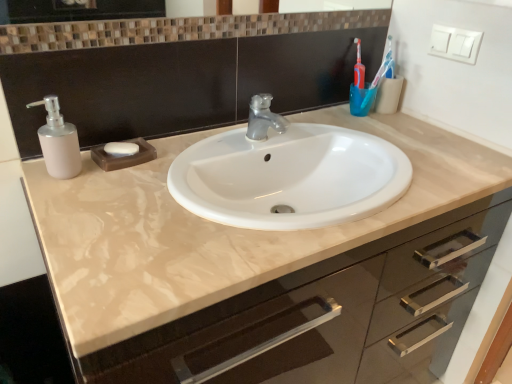
Question: Is matte white soap dispenser at left shorter than white matte soap at center?

Choices:
 (A) no
 (B) yes

Answer: (A)

Question: Does matte white soap dispenser at left have a smaller size compared to white matte soap at center?

Choices:
 (A) yes
 (B) no

Answer: (B)

Question: Can we say matte white soap dispenser at left lies outside white matte soap at center?

Choices:
 (A) yes
 (B) no

Answer: (A)

Question: Is matte white soap dispenser at left positioned far away from white matte soap at center?

Choices:
 (A) no
 (B) yes

Answer: (A)

Question: Is matte white soap dispenser at left looking in the opposite direction of white matte soap at center?

Choices:
 (A) no
 (B) yes

Answer: (A)

Question: Is matte white soap dispenser at left beside white matte soap at center?

Choices:
 (A) yes
 (B) no

Answer: (B)

Question: Considering the relative sizes of matte white soap dispenser at left and matte beige cabinet at center in the image provided, is matte white soap dispenser at left smaller than matte beige cabinet at center?

Choices:
 (A) yes
 (B) no

Answer: (A)

Question: Is matte white soap dispenser at left shorter than matte beige cabinet at center?

Choices:
 (A) yes
 (B) no

Answer: (A)

Question: Could you tell me if matte white soap dispenser at left is facing matte beige cabinet at center?

Choices:
 (A) yes
 (B) no

Answer: (B)

Question: From the image's perspective, is matte white soap dispenser at left beneath matte beige cabinet at center?

Choices:
 (A) no
 (B) yes

Answer: (A)

Question: Does matte white soap dispenser at left appear on the left side of matte beige cabinet at center?

Choices:
 (A) no
 (B) yes

Answer: (B)

Question: From a real-world perspective, does matte white soap dispenser at left sit lower than matte beige cabinet at center?

Choices:
 (A) yes
 (B) no

Answer: (B)

Question: Considering the relative sizes of brown mosaic tile mirror at upper center and white matte soap at center in the image provided, is brown mosaic tile mirror at upper center smaller than white matte soap at center?

Choices:
 (A) yes
 (B) no

Answer: (B)